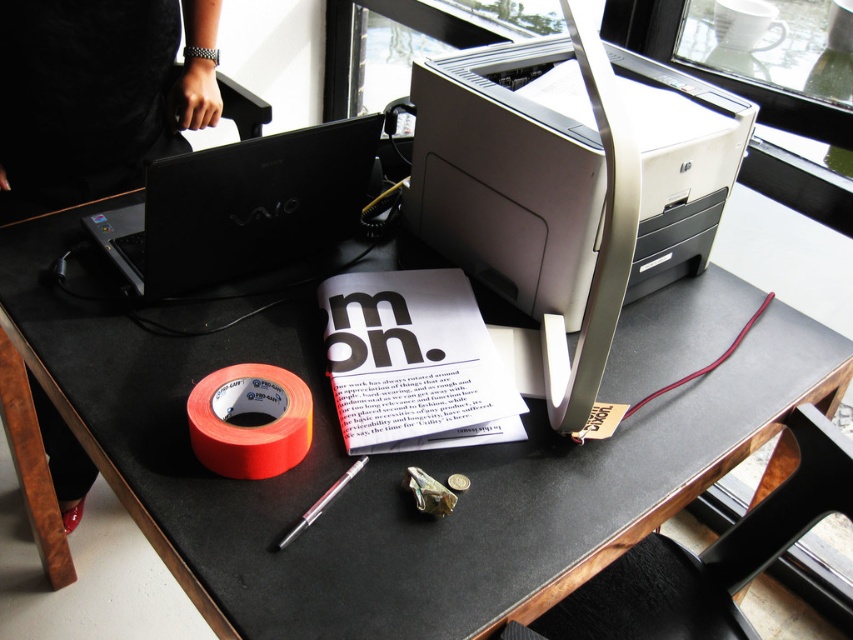
Question: Considering the real-world distances, which object is farthest from the orange matte tape at lower left?

Choices:
 (A) beige plastic printer at center
 (B) metallic silver pen at center

Answer: (A)

Question: Which point appears farthest from the camera in this image?

Choices:
 (A) (202, 400)
 (B) (305, 512)

Answer: (A)

Question: Does beige plastic printer at center have a larger size compared to metallic silver pen at center?

Choices:
 (A) yes
 (B) no

Answer: (A)

Question: Can you confirm if orange matte tape at lower left is positioned below metallic silver pen at center?

Choices:
 (A) no
 (B) yes

Answer: (A)

Question: Does black matte laptop at upper left appear over metallic silver pen at center?

Choices:
 (A) yes
 (B) no

Answer: (A)

Question: Which of the following is the farthest from the observer?

Choices:
 (A) (349, 468)
 (B) (209, 273)

Answer: (B)